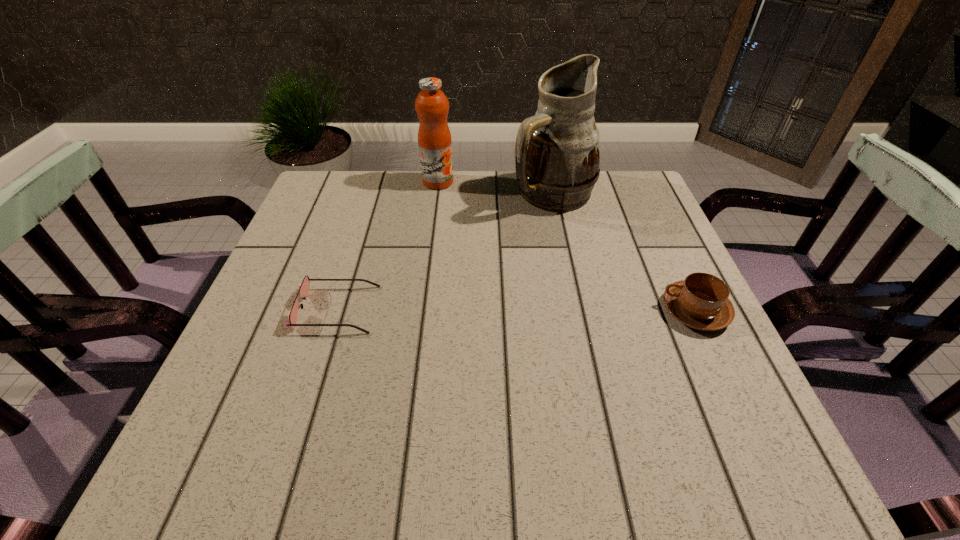
The width and height of the screenshot is (960, 540). I want to click on empty space between the third object from left to right and the second tallest object, so click(x=495, y=188).

Where is `the third closest object to the third object from left to right`? This screenshot has width=960, height=540. the third closest object to the third object from left to right is located at coordinates [304, 287].

Select which object appears as the third closest to the leftmost object. Please provide its 2D coordinates. Your answer should be formatted as a tuple, i.e. [(x, y)], where the tuple contains the x and y coordinates of a point satisfying the conditions above.

[(701, 301)]

Identify the location of free spot that satisfies the following two spatial constraints: 1. on the front side of the third object from right to left; 2. on the left side of the second object from right to left. (437, 194).

Image resolution: width=960 pixels, height=540 pixels. I want to click on vacant space that satisfies the following two spatial constraints: 1. on the front side of the second shortest object; 2. on the side of the second object from right to left with the handle, so click(577, 310).

At what (x,y) coordinates should I click in order to perform the action: click on vacant point that satisfies the following two spatial constraints: 1. on the front side of the third tallest object; 2. on the side of the third object from left to right with the handle. Please return your answer as a coordinate pair (x, y). This screenshot has height=540, width=960. Looking at the image, I should click on (577, 310).